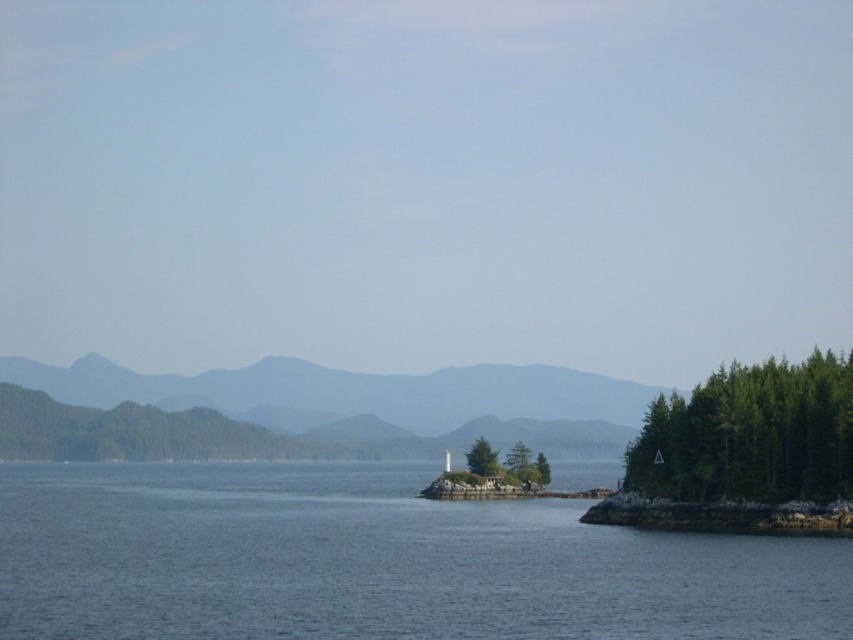
Does blue water at center have a larger size compared to green textured trees at right?

Correct, blue water at center is larger in size than green textured trees at right.

Who is more forward, [26,540] or [634,483]?

Point [26,540] is more forward.

Locate an element on the screen. The image size is (853, 640). blue water at center is located at coordinates (376, 563).

Which is in front, point (614, 404) or point (494, 464)?

Point (494, 464) is more forward.

Does gray textured mountain at center have a lesser width compared to green matte tree at center?

In fact, gray textured mountain at center might be wider than green matte tree at center.

Describe the element at coordinates (368, 400) in the screenshot. The image size is (853, 640). I see `gray textured mountain at center` at that location.

Where is `gray textured mountain at center`? gray textured mountain at center is located at coordinates (368, 400).

Which of these two, green textured trees at right or green matte tree at center, stands taller?

green textured trees at right

Does green textured trees at right have a lesser width compared to green matte tree at center?

No, green textured trees at right is not thinner than green matte tree at center.

Does point (807, 356) lie in front of point (469, 461)?

Yes.

The width and height of the screenshot is (853, 640). I want to click on green textured trees at right, so click(x=750, y=435).